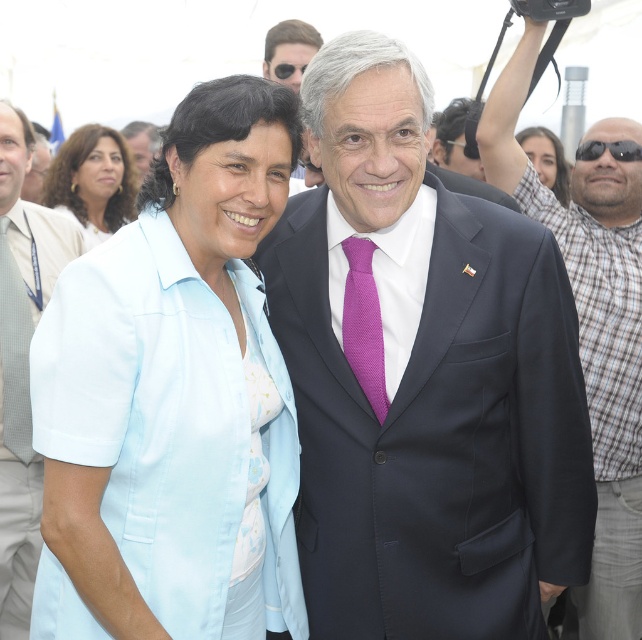
Can you confirm if light blue fabric shirt at center is positioned to the right of matte black hair at upper right?

Incorrect, light blue fabric shirt at center is not on the right side of matte black hair at upper right.

How far apart are light blue fabric shirt at center and matte black hair at upper right?

They are 3.69 meters apart.

The height and width of the screenshot is (640, 642). What do you see at coordinates (171, 392) in the screenshot?
I see `light blue fabric shirt at center` at bounding box center [171, 392].

Identify the location of light blue fabric shirt at center. The height and width of the screenshot is (640, 642). (171, 392).

Is matte black suit at center above sunglasses at right?

Indeed, matte black suit at center is positioned over sunglasses at right.

Looking at this image, who is positioned more to the right, matte black suit at center or sunglasses at right?

sunglasses at right

Find the location of a particular element. matte black suit at center is located at coordinates (141, 145).

Between light blue fabric shirt at center and dark blue suit at center, which one is positioned lower?

Positioned lower is dark blue suit at center.

This screenshot has width=642, height=640. Describe the element at coordinates (171, 392) in the screenshot. I see `light blue fabric shirt at center` at that location.

Locate an element on the screen. The height and width of the screenshot is (640, 642). light blue fabric shirt at center is located at coordinates (171, 392).